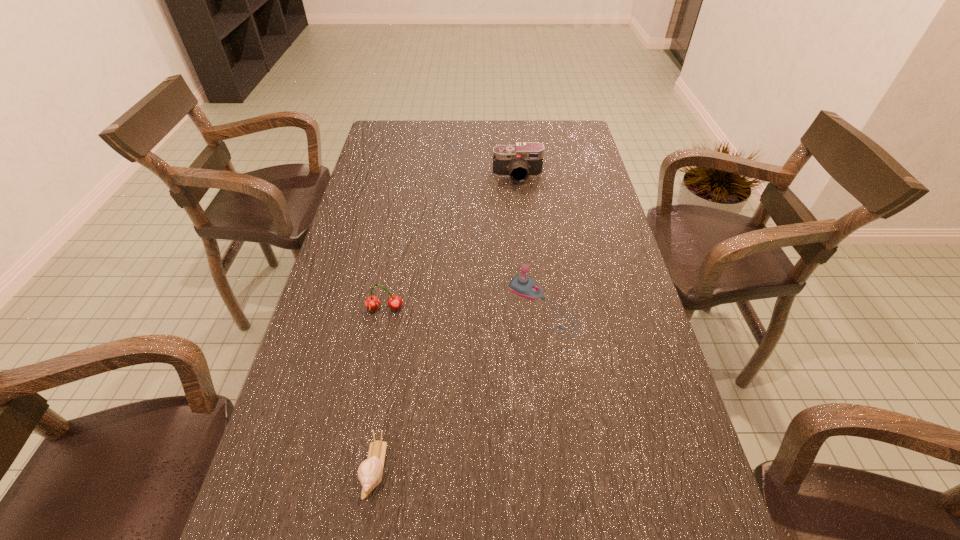
Locate an element on the screen. The width and height of the screenshot is (960, 540). the farthest object is located at coordinates (524, 159).

The height and width of the screenshot is (540, 960). In order to click on cherry in this screenshot , I will do `click(372, 302)`.

Find the location of a particular element. joystick is located at coordinates (524, 286).

In order to click on the shortest object in this screenshot , I will do `click(370, 471)`.

The height and width of the screenshot is (540, 960). What are the coordinates of `escargot` in the screenshot? It's located at (370, 471).

Image resolution: width=960 pixels, height=540 pixels. I want to click on free space located 0.200m on the front-facing side of the camera, so click(x=522, y=223).

Locate an element on the screen. vacant space located 0.310m with stems pointing upwards on the cherry is located at coordinates (360, 437).

Locate an element on the screen. The image size is (960, 540). blank space located on the back of the joystick is located at coordinates (534, 240).

In order to click on object located in the left edge section of the desktop in this screenshot , I will do `click(372, 302)`.

Locate an element on the screen. The image size is (960, 540). object present at the right edge is located at coordinates (524, 286).